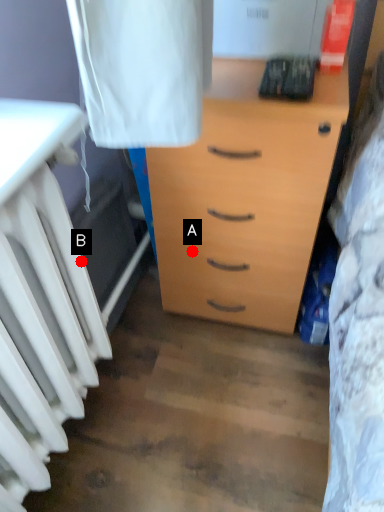
Question: Two points are circled on the image, labeled by A and B beside each circle. Among these points, which one is nearest to the camera?

Choices:
 (A) A is closer
 (B) B is closer

Answer: (B)